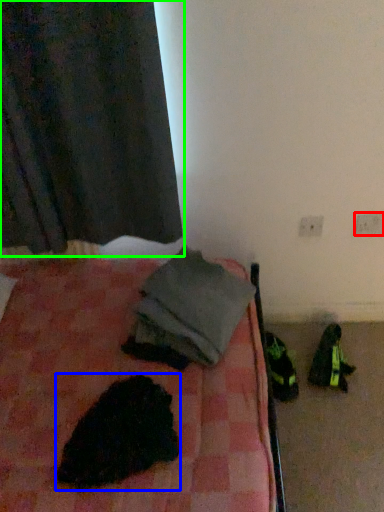
Question: Which is nearer to the electric outlet (highlighted by a red box)? animal (highlighted by a blue box) or curtain (highlighted by a green box).

Choices:
 (A) animal
 (B) curtain

Answer: (B)